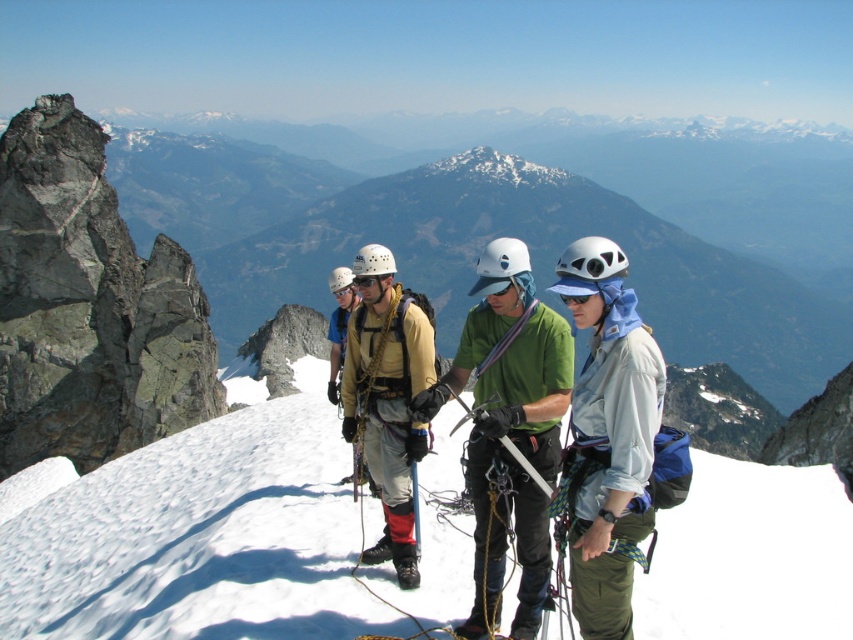
Question: Among these points, which one is farthest from the camera?

Choices:
 (A) (601, 304)
 (B) (498, 324)

Answer: (B)

Question: Can you confirm if green fabric shirt at center is bigger than light blue fabric jacket at center?

Choices:
 (A) no
 (B) yes

Answer: (B)

Question: Is green fabric shirt at center bigger than blue matte sunglasses at center?

Choices:
 (A) yes
 (B) no

Answer: (A)

Question: Does green fabric shirt at center appear on the left side of blue matte sunglasses at center?

Choices:
 (A) yes
 (B) no

Answer: (A)

Question: Based on their relative distances, which object is farther from the light blue fabric jacket at center?

Choices:
 (A) green fabric shirt at center
 (B) blue matte sunglasses at center

Answer: (B)

Question: Which point appears closest to the camera in this image?

Choices:
 (A) (517, 620)
 (B) (583, 573)
 (C) (560, 294)

Answer: (B)